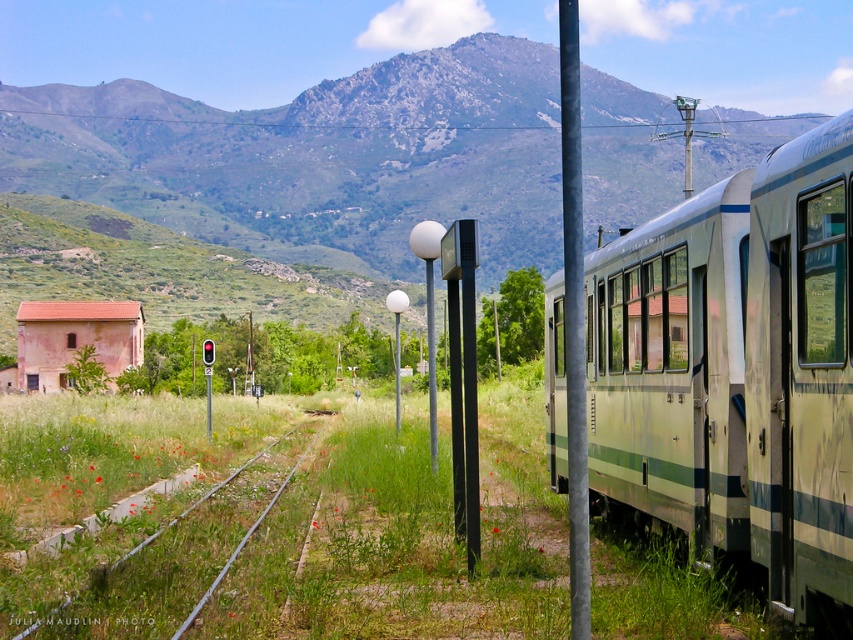
Question: Is green metallic train at right smaller than green grassy track at center?

Choices:
 (A) yes
 (B) no

Answer: (A)

Question: Based on their relative distances, which object is nearer to the clear glass window at right?

Choices:
 (A) green grassy track at center
 (B) metallic pole at center-right
 (C) green metallic train at right

Answer: (C)

Question: Which point is farther from the camera taking this photo?

Choices:
 (A) (817, 348)
 (B) (35, 605)
 (C) (595, 454)

Answer: (C)

Question: Based on their relative distances, which object is nearer to the clear glass window at right?

Choices:
 (A) green metallic train at right
 (B) metallic pole at center-right

Answer: (A)

Question: Observing the image, what is the correct spatial positioning of green grassy track at center in reference to clear glass window at right?

Choices:
 (A) above
 (B) below

Answer: (B)

Question: Is green grassy track at center thinner than metallic pole at center-right?

Choices:
 (A) yes
 (B) no

Answer: (B)